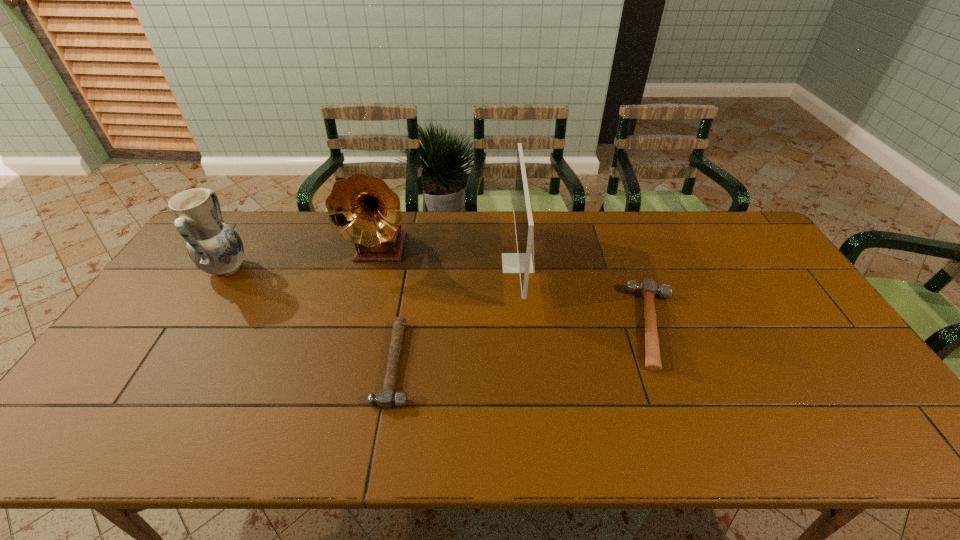
Identify the location of free location located on the front-facing side of the fourth object from left to right. The image size is (960, 540). (416, 263).

Identify the location of vacant space located 0.380m on either side of the pottery. The width and height of the screenshot is (960, 540). (369, 269).

Where is `free region located 0.370m on the left of the taller hammer`? The height and width of the screenshot is (540, 960). free region located 0.370m on the left of the taller hammer is located at coordinates (497, 326).

Identify the location of free space located on the striking face of the shortest object. This screenshot has width=960, height=540. (560, 363).

The image size is (960, 540). What are the coordinates of `phonograph_record that is at the far edge` in the screenshot? It's located at (364, 210).

Locate an element on the screen. monitor situated at the far edge is located at coordinates click(x=522, y=262).

This screenshot has width=960, height=540. In order to click on pottery that is at the far edge in this screenshot , I will do 214,247.

Identify the location of object positioned at the left edge. The height and width of the screenshot is (540, 960). (214, 247).

This screenshot has height=540, width=960. I want to click on object that is at the far left corner, so click(214, 247).

This screenshot has height=540, width=960. In the image, there is a desktop. Find the location of `blank space at the far edge`. blank space at the far edge is located at coordinates pyautogui.click(x=420, y=227).